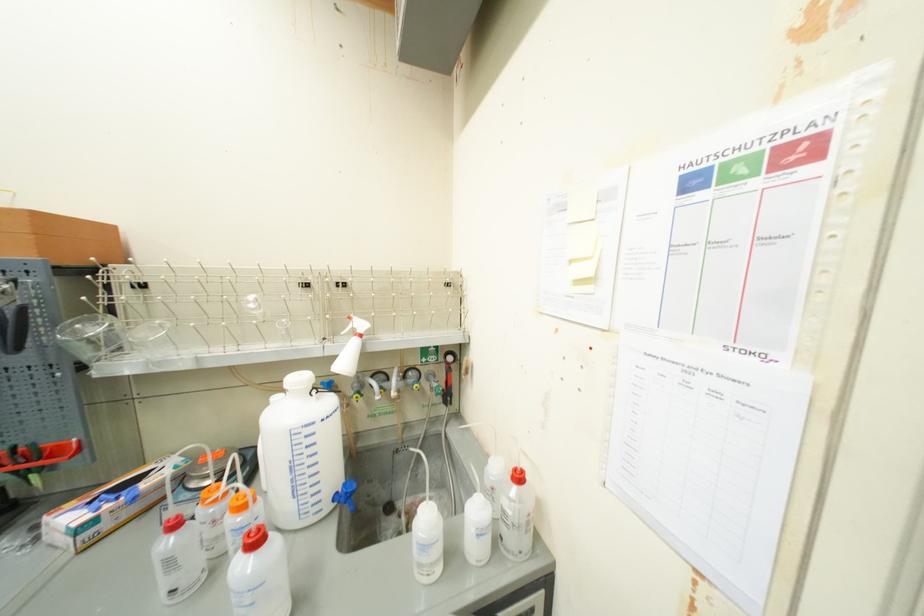
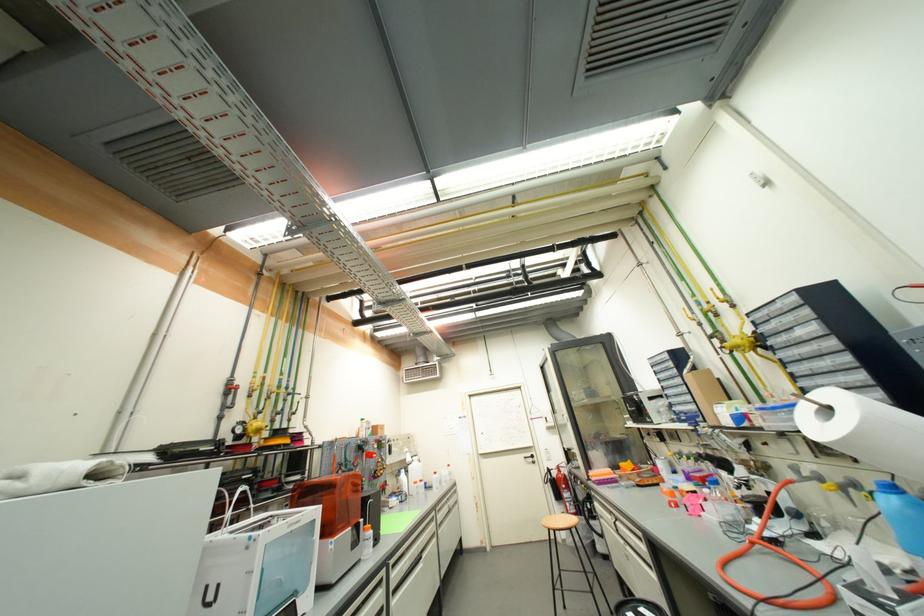
Question: I am providing you with two images of the same scene from different viewpoints. Please identify which objects are invisible in image2.

Choices:
 (A) white cabinet handle
 (B) grey faucet knob
 (C) yellow valve handle
 (D) tablet tube

Answer: (B)